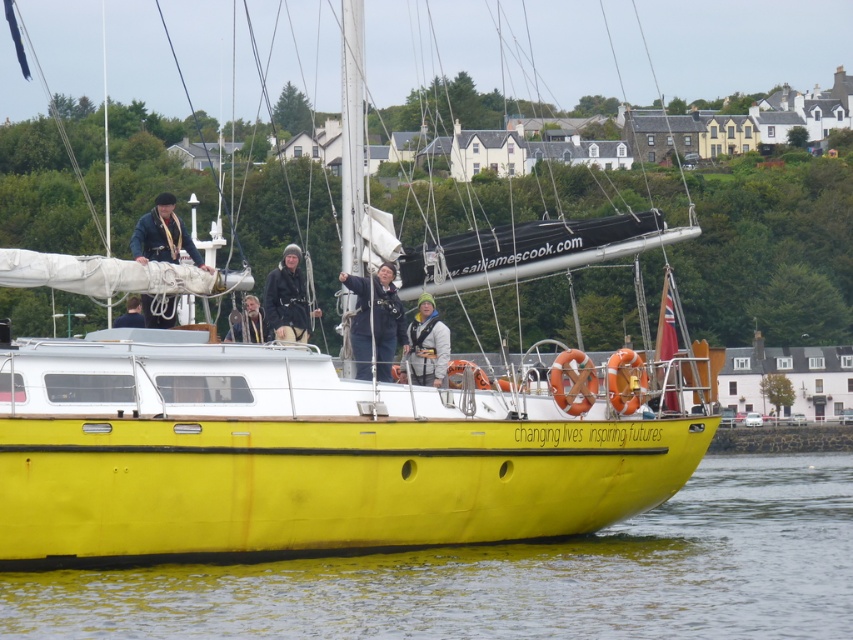
Between matte blue jacket at upper left and orange rubber life jacket at center, which one appears on the left side from the viewer's perspective?

matte blue jacket at upper left

Is matte blue jacket at upper left to the left of orange rubber life jacket at center from the viewer's perspective?

Correct, you'll find matte blue jacket at upper left to the left of orange rubber life jacket at center.

The width and height of the screenshot is (853, 640). In order to click on matte blue jacket at upper left in this screenshot , I will do `click(163, 236)`.

From the picture: Measure the distance between yellow matte water at lower center and orange rubber life jacket at center.

yellow matte water at lower center and orange rubber life jacket at center are 20.77 meters apart from each other.

Does yellow matte water at lower center have a lesser width compared to orange rubber life jacket at center?

In fact, yellow matte water at lower center might be wider than orange rubber life jacket at center.

Is point (527, 596) more distant than point (582, 397)?

No, (527, 596) is in front of (582, 397).

This screenshot has height=640, width=853. I want to click on yellow matte water at lower center, so click(512, 577).

Can you confirm if dark gray knit hat at center is taller than smooth wooden figure at center?

Yes, dark gray knit hat at center is taller than smooth wooden figure at center.

Which is below, dark gray knit hat at center or smooth wooden figure at center?

smooth wooden figure at center is lower down.

Between point (287, 264) and point (259, 320), which one is positioned in front?

Point (259, 320) is in front.

Locate an element on the screen. The width and height of the screenshot is (853, 640). dark gray knit hat at center is located at coordinates (287, 298).